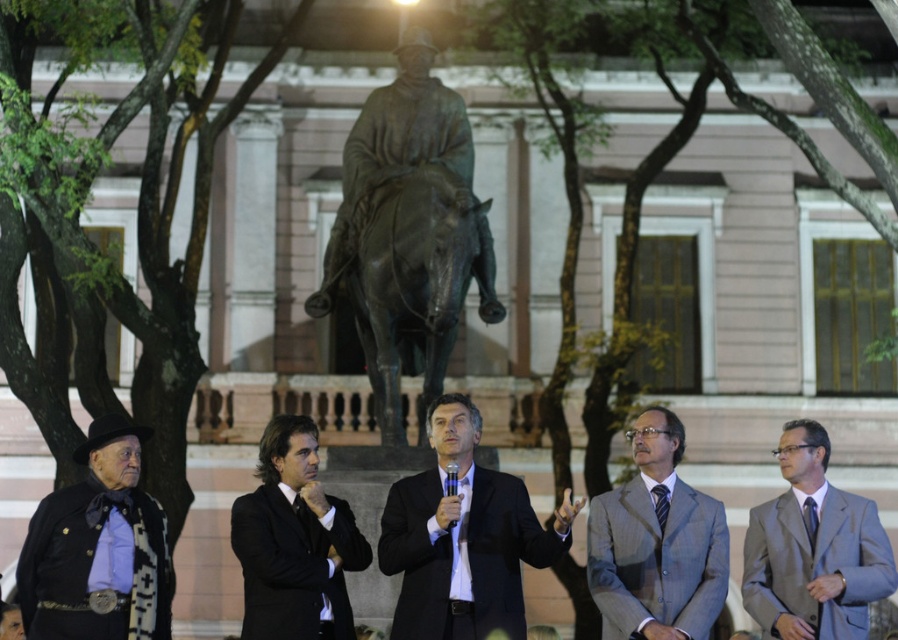
What object is located at the coordinate point (656, 545) in the scene?

The gray textured suit at center is located at the coordinate point (656, 545).

You are a photographer at the event and need to ensure that both the gray textured suit at center and the striped silk tie at center are visible in your portrait. Since you can only focus on one subject, which one should you focus on to ensure both are in the frame?

You should focus on the gray textured suit at center because it is taller than the striped silk tie at center, so keeping it in focus will naturally include the shorter striped silk tie at center within the frame.

You are a photographer at the event and need to capture a clear photo of the gray textured suit at center without the rustic leather jacket at left blocking it. How can you adjust your position to achieve this?

Move to the right side of the scene so that the gray textured suit at center is no longer behind the rustic leather jacket at left.